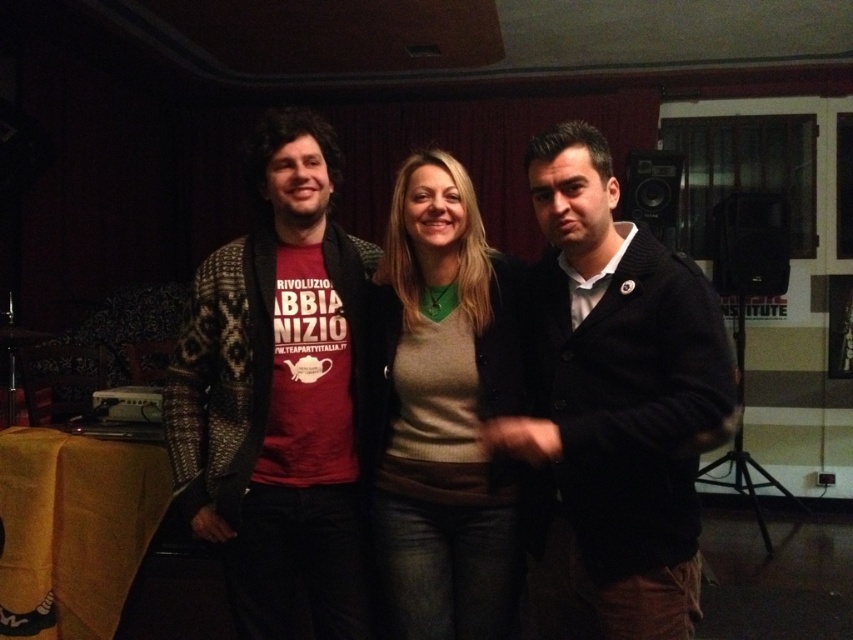
Question: Is dark woolen jacket at center thinner than matte beige sweater at center?

Choices:
 (A) yes
 (B) no

Answer: (B)

Question: Does knitted sweater at center appear on the right side of matte beige sweater at center?

Choices:
 (A) no
 (B) yes

Answer: (A)

Question: Which object is positioned farthest from the matte beige sweater at center?

Choices:
 (A) knitted sweater at center
 (B) dark woolen jacket at center

Answer: (B)

Question: Which of the following is the closest to the observer?

Choices:
 (A) (585, 193)
 (B) (270, 285)

Answer: (A)

Question: Can you confirm if knitted sweater at center is positioned below matte beige sweater at center?

Choices:
 (A) no
 (B) yes

Answer: (A)

Question: Which point is farther from the camera taking this photo?

Choices:
 (A) (569, 220)
 (B) (341, 314)

Answer: (B)